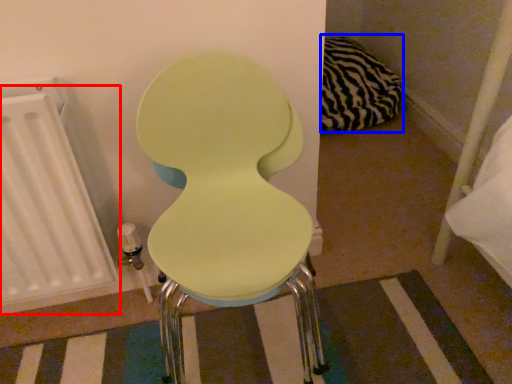
Question: Which object is further to the camera taking this photo, radiator (highlighted by a red box) or pillow (highlighted by a blue box)?

Choices:
 (A) radiator
 (B) pillow

Answer: (B)